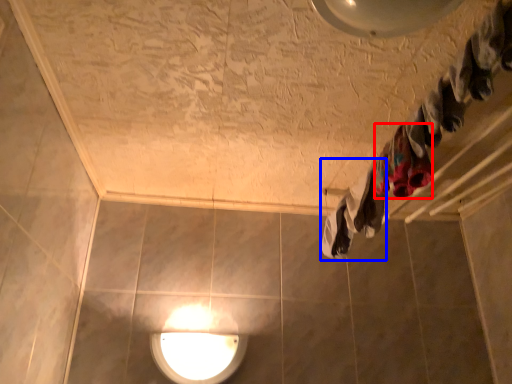
Question: Among these objects, which one is farthest to the camera, clothing (highlighted by a red box) or clothing (highlighted by a blue box)?

Choices:
 (A) clothing
 (B) clothing

Answer: (B)